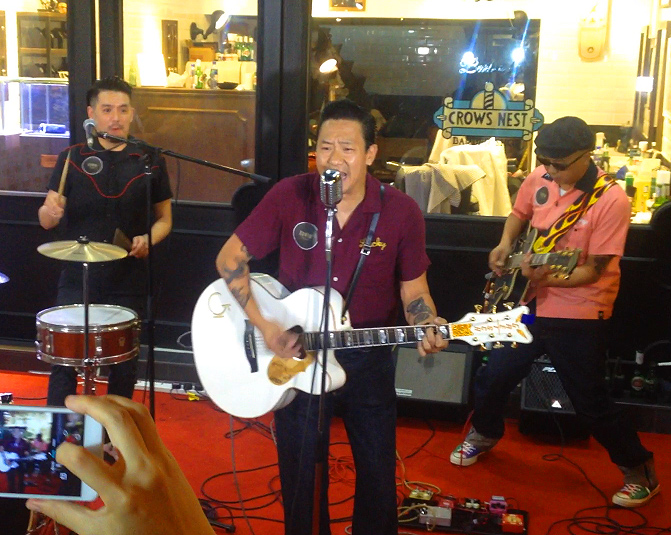
This screenshot has width=671, height=535. I want to click on phone, so click(x=45, y=435).